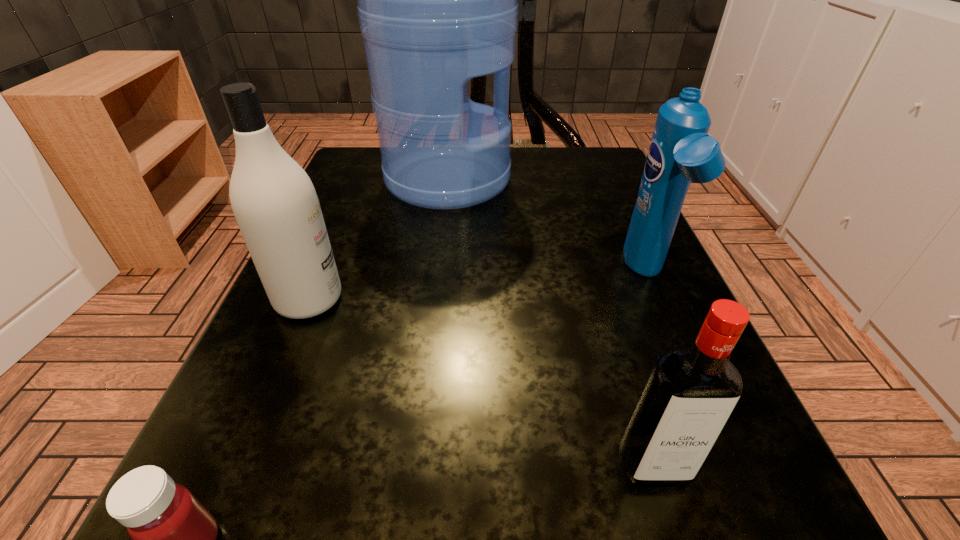
Identify the location of free space at the right edge. (613, 212).

In the image, there is a desktop. Where is `vacant region at the far left corner`? Image resolution: width=960 pixels, height=540 pixels. vacant region at the far left corner is located at coordinates (374, 152).

Locate an element on the screen. vacant space at the far right corner is located at coordinates (588, 173).

Locate an element on the screen. This screenshot has width=960, height=540. unoccupied position between the rightmost object and the farthest object is located at coordinates (547, 227).

Where is `blank region between the left shampoo and the right shampoo`? This screenshot has height=540, width=960. blank region between the left shampoo and the right shampoo is located at coordinates (478, 287).

Locate an element on the screen. The height and width of the screenshot is (540, 960). unoccupied area between the right shampoo and the second shortest object is located at coordinates (650, 369).

The height and width of the screenshot is (540, 960). I want to click on object that is the fourth closest to the water jug, so click(173, 535).

Point out which object is positioned as the fourth nearest to the right shampoo. Please provide its 2D coordinates. Your answer should be formatted as a tuple, i.e. [(x, y)], where the tuple contains the x and y coordinates of a point satisfying the conditions above.

[(173, 535)]

At what (x,y) coordinates should I click in order to perform the action: click on blank area in the image that satisfies the following two spatial constraints: 1. on the side of the right shampoo with the handle; 2. on the left side of the water jug. Please return your answer as a coordinate pair (x, y). Looking at the image, I should click on (437, 274).

This screenshot has width=960, height=540. I want to click on vacant position in the image that satisfies the following two spatial constraints: 1. on the side of the rightmost object with the handle; 2. on the right side of the tallest object, so click(x=437, y=274).